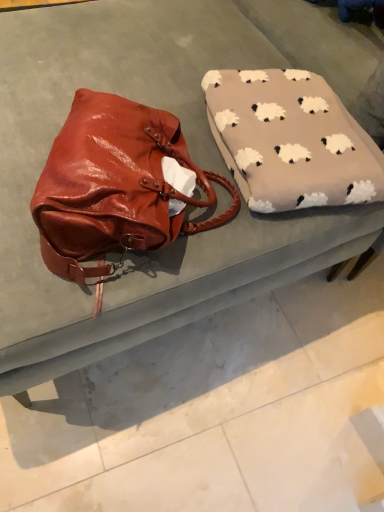
Where is `free point above matte leather bag at left (from a real-world perspective)`? The image size is (384, 512). free point above matte leather bag at left (from a real-world perspective) is located at coordinates tap(231, 399).